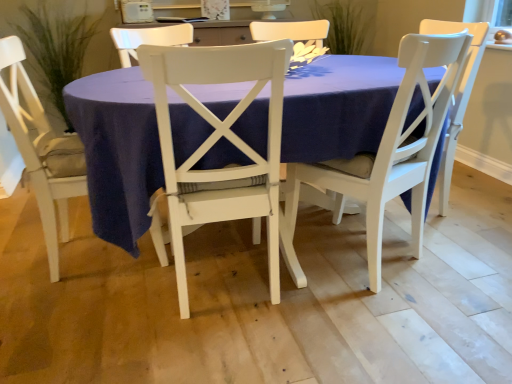
This screenshot has width=512, height=384. Find the location of `white wood chair at center, acting as the 2th chair starting from the left`. white wood chair at center, acting as the 2th chair starting from the left is located at coordinates (217, 140).

What is the approximate width of white wood chair at center, the 3th chair viewed from the left?

white wood chair at center, the 3th chair viewed from the left, is 44.32 centimeters in width.

Where is `matte white table at center`? This screenshot has width=512, height=384. matte white table at center is located at coordinates (118, 151).

Find the location of a particular element. white wood chair at center, the 2th chair positioned from the right is located at coordinates (217, 140).

Is white wood chair at center, the first chair from the right, looking in the opposite direction of green leafy plant at upper center, which is the second plant in left-to-right order?

No, white wood chair at center, the first chair from the right,'s orientation is not away from green leafy plant at upper center, which is the second plant in left-to-right order.

Considering the relative sizes of white wood chair at center, the 3th chair viewed from the left, and green leafy plant at upper center, which is the 1th plant in right-to-left order, in the image provided, is white wood chair at center, the 3th chair viewed from the left, smaller than green leafy plant at upper center, which is the 1th plant in right-to-left order,?

Incorrect, white wood chair at center, the 3th chair viewed from the left, is not smaller in size than green leafy plant at upper center, which is the 1th plant in right-to-left order.

Considering the relative sizes of white wood chair at center, the first chair from the right, and green leafy plant at upper center, which is the 1th plant in right-to-left order, in the image provided, is white wood chair at center, the first chair from the right, shorter than green leafy plant at upper center, which is the 1th plant in right-to-left order,?

In fact, white wood chair at center, the first chair from the right, may be taller than green leafy plant at upper center, which is the 1th plant in right-to-left order.

From a real-world perspective, is white wood chair at center, the 3th chair viewed from the left, positioned over green leafy plant at upper center, which is the second plant in left-to-right order, based on gravity?

Actually, white wood chair at center, the 3th chair viewed from the left, is physically below green leafy plant at upper center, which is the second plant in left-to-right order, in the real world.

Is green leafy plant at left, the 1th plant from the left, touching white wood chair at center, the first chair from the right?

No, green leafy plant at left, the 1th plant from the left, is not beside white wood chair at center, the first chair from the right.

Based on the photo, can white wood chair at center, the first chair from the right, be found inside green leafy plant at left, the second plant when ordered from right to left?

No, white wood chair at center, the first chair from the right, is not inside green leafy plant at left, the second plant when ordered from right to left.

Where is `the 1st plant directly above the white wood chair at center, the first chair from the right (from a real-world perspective)`? The width and height of the screenshot is (512, 384). the 1st plant directly above the white wood chair at center, the first chair from the right (from a real-world perspective) is located at coordinates (54, 48).

Considering the sizes of green leafy plant at left, the 1th plant from the left, and white wood chair at center, the 3th chair viewed from the left, in the image, is green leafy plant at left, the 1th plant from the left, bigger or smaller than white wood chair at center, the 3th chair viewed from the left,?

In the image, green leafy plant at left, the 1th plant from the left, appears to be larger than white wood chair at center, the 3th chair viewed from the left.

Is green leafy plant at upper center, which is the 1th plant in right-to-left order, next to matte white table at center?

They are not placed beside each other.

Is green leafy plant at upper center, which is the second plant in left-to-right order, at the left side of matte white table at center?

In fact, green leafy plant at upper center, which is the second plant in left-to-right order, is to the right of matte white table at center.

How distant is green leafy plant at upper center, which is the second plant in left-to-right order, from matte white table at center?

green leafy plant at upper center, which is the second plant in left-to-right order, is 6.82 feet from matte white table at center.

From a real-world perspective, is green leafy plant at upper center, which is the 1th plant in right-to-left order, under matte white table at center?

No, from a real-world perspective, green leafy plant at upper center, which is the 1th plant in right-to-left order, is not beneath matte white table at center.

There is a matte white table at center. Identify the location of the 2nd chair below it (from the image's perspective). Image resolution: width=512 pixels, height=384 pixels. (386, 154).

Could you measure the distance between white wood chair at center, the first chair from the right, and matte white table at center?

white wood chair at center, the first chair from the right, is 12.42 inches away from matte white table at center.

Can you tell me how much white wood chair at center, the 3th chair viewed from the left, and matte white table at center differ in facing direction?

white wood chair at center, the 3th chair viewed from the left, and matte white table at center are facing 69.2 degrees away from each other.

Does point (444, 38) appear closer or farther from the camera than point (388, 106)?

Point (444, 38).

Is white wood chair at center, the 3th chair viewed from the left, not within white wood chair at center, the 2th chair positioned from the right?

Absolutely, white wood chair at center, the 3th chair viewed from the left, is external to white wood chair at center, the 2th chair positioned from the right.

In terms of size, does white wood chair at center, the first chair from the right, appear bigger or smaller than white wood chair at center, acting as the 2th chair starting from the left?

Considering their sizes, white wood chair at center, the first chair from the right, takes up less space than white wood chair at center, acting as the 2th chair starting from the left.

Which is nearer, [441,47] or [243,55]?

Point [441,47] appears to be farther away from the viewer than point [243,55].

Is white wood chair at center, the first chair from the right, positioned with its back to white wood chair at center, acting as the 2th chair starting from the left?

No, white wood chair at center, the first chair from the right,'s orientation is not away from white wood chair at center, acting as the 2th chair starting from the left.

From a real-world perspective, between white wood chair at center, the 3th chair viewed from the left, and white painted wood chair at lower left, marked as the 3th chair in a right-to-left arrangement, who is vertically lower?

white painted wood chair at lower left, marked as the 3th chair in a right-to-left arrangement.

Looking at this image, from the image's perspective, which object appears higher, white wood chair at center, the first chair from the right, or white painted wood chair at lower left, positioned as the first chair in left-to-right order?

white painted wood chair at lower left, positioned as the first chair in left-to-right order, from the image's perspective.

Can you confirm if white wood chair at center, the first chair from the right, is bigger than white painted wood chair at lower left, marked as the 3th chair in a right-to-left arrangement?

Incorrect, white wood chair at center, the first chair from the right, is not larger than white painted wood chair at lower left, marked as the 3th chair in a right-to-left arrangement.

Consider the image. Can you confirm if white wood chair at center, the 3th chair viewed from the left, is taller than white painted wood chair at lower left, positioned as the first chair in left-to-right order?

Correct, white wood chair at center, the 3th chair viewed from the left, is much taller as white painted wood chair at lower left, positioned as the first chair in left-to-right order.

Does green leafy plant at upper center, which is the second plant in left-to-right order, have a smaller size compared to green leafy plant at left, the 1th plant from the left?

Yes.

Is green leafy plant at upper center, which is the 1th plant in right-to-left order, taller than green leafy plant at left, the 1th plant from the left?

Incorrect, the height of green leafy plant at upper center, which is the 1th plant in right-to-left order, is not larger of that of green leafy plant at left, the 1th plant from the left.

Is green leafy plant at upper center, which is the second plant in left-to-right order, positioned with its back to green leafy plant at left, the 1th plant from the left?

No, green leafy plant at upper center, which is the second plant in left-to-right order, is not facing away from green leafy plant at left, the 1th plant from the left.

How many degrees apart are the facing directions of green leafy plant at upper center, which is the 1th plant in right-to-left order, and green leafy plant at left, the 1th plant from the left?

1.59 degrees separate the facing orientations of green leafy plant at upper center, which is the 1th plant in right-to-left order, and green leafy plant at left, the 1th plant from the left.

Identify the location of plant that is the 2nd one when counting upward from the white wood chair at center, the 3th chair viewed from the left (from the image's perspective). (345, 25).

From the image's perspective, count 2nd chairs downward from the green leafy plant at left, the second plant when ordered from right to left, and point to it. Please provide its 2D coordinates.

[(386, 154)]

Estimate the real-world distances between objects in this image. Which object is closer to white painted wood chair at lower left, marked as the 3th chair in a right-to-left arrangement, white wood chair at center, acting as the 2th chair starting from the left, or matte white table at center?

matte white table at center is closer to white painted wood chair at lower left, marked as the 3th chair in a right-to-left arrangement.

When comparing their distances from matte white table at center, does white wood chair at center, the first chair from the right, or white wood chair at center, the 2th chair positioned from the right, seem closer?

The object closer to matte white table at center is white wood chair at center, the 2th chair positioned from the right.

Based on their spatial positions, is white wood chair at center, the 2th chair positioned from the right, or matte white table at center closer to white wood chair at center, the 3th chair viewed from the left?

matte white table at center is closer to white wood chair at center, the 3th chair viewed from the left.

In the scene shown: Considering their positions, is white wood chair at center, the first chair from the right, positioned closer to green leafy plant at left, the 1th plant from the left, than green leafy plant at upper center, which is the second plant in left-to-right order?

green leafy plant at upper center, which is the second plant in left-to-right order.

Estimate the real-world distances between objects in this image. Which object is further from white painted wood chair at lower left, positioned as the first chair in left-to-right order, white wood chair at center, the 2th chair positioned from the right, or green leafy plant at upper center, which is the second plant in left-to-right order?

green leafy plant at upper center, which is the second plant in left-to-right order, lies further to white painted wood chair at lower left, positioned as the first chair in left-to-right order, than the other object.

From the image, which object appears to be nearer to green leafy plant at upper center, which is the second plant in left-to-right order, white painted wood chair at lower left, marked as the 3th chair in a right-to-left arrangement, or white wood chair at center, the first chair from the right?

white wood chair at center, the first chair from the right, is closer to green leafy plant at upper center, which is the second plant in left-to-right order.

From the image, which object appears to be nearer to white wood chair at center, the 3th chair viewed from the left, matte white table at center or white wood chair at center, acting as the 2th chair starting from the left?

The object closer to white wood chair at center, the 3th chair viewed from the left, is matte white table at center.

Which object lies further to the anchor point green leafy plant at left, the second plant when ordered from right to left, green leafy plant at upper center, which is the 1th plant in right-to-left order, or white painted wood chair at lower left, marked as the 3th chair in a right-to-left arrangement?

The object further to green leafy plant at left, the second plant when ordered from right to left, is green leafy plant at upper center, which is the 1th plant in right-to-left order.

The width and height of the screenshot is (512, 384). I want to click on kitchen & dining room table between green leafy plant at left, the second plant when ordered from right to left, and green leafy plant at upper center, which is the 1th plant in right-to-left order, from left to right, so click(118, 151).

Identify the location of kitchen & dining room table between white wood chair at center, the 2th chair positioned from the right, and green leafy plant at upper center, which is the second plant in left-to-right order, from front to back. (118, 151).

The height and width of the screenshot is (384, 512). In order to click on kitchen & dining room table between white wood chair at center, the 2th chair positioned from the right, and white wood chair at center, the first chair from the right, in the horizontal direction in this screenshot , I will do `click(118, 151)`.

Locate an element on the screen. This screenshot has width=512, height=384. kitchen & dining room table positioned between white wood chair at center, the 2th chair positioned from the right, and green leafy plant at left, the second plant when ordered from right to left, from near to far is located at coordinates (118, 151).